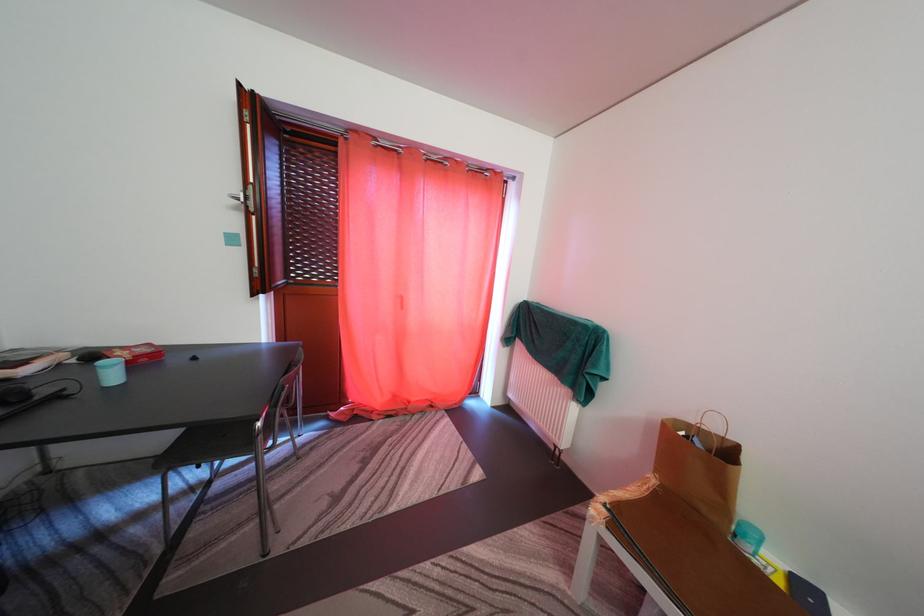
Describe the element at coordinates (245, 195) in the screenshot. I see `a silver door handle` at that location.